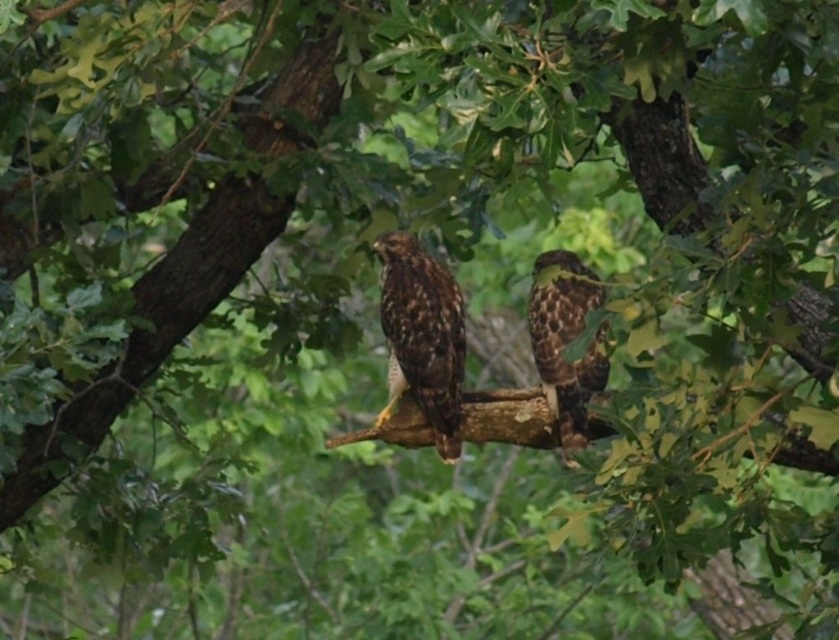
You are a birdwatcher trying to capture both hawks in a single photo. The camera you have can only focus on objects within a 10 inch range. Can you fit both the brown feathered eagle at center and the brown speckled eagle at center into the camera frame without moving the camera?

The brown feathered eagle at center and the brown speckled eagle at center are 12.25 inches apart. Since the camera can only focus on objects within a 10 inch range, the distance between them exceeds the camera frame capacity. Therefore, you cannot fit both hawks into the camera frame without moving it.

You are an ornithologist observing two hawks on a branch. You notice two points marked on the image. The first point is at coordinates point (399, 348) and the second is at point (560, 368). Based on their positions, which point is closer to the front of the branch?

Point (560, 368) is closer to the front of the branch because it is in front of point (399, 348).